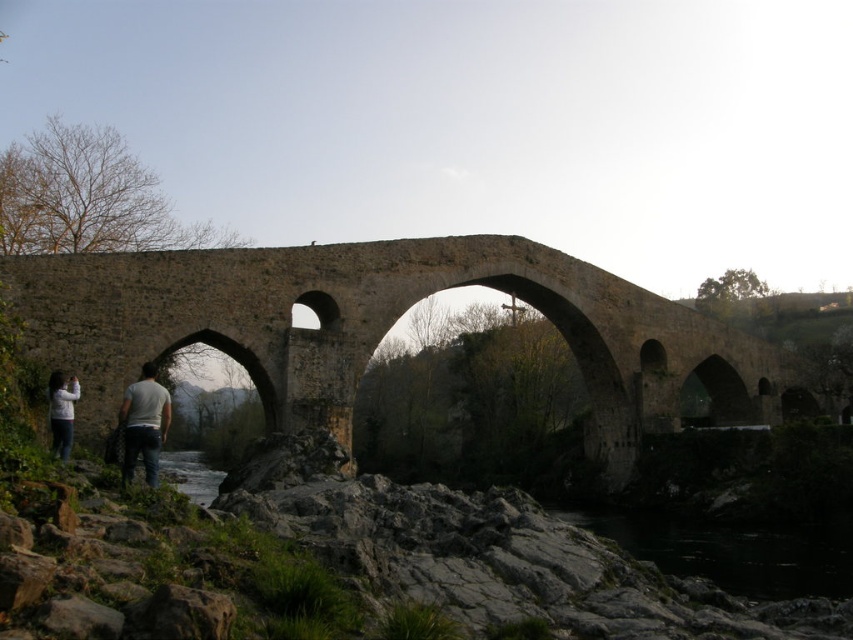
Question: Estimate the real-world distances between objects in this image. Which object is farther from the clear water at lower center?

Choices:
 (A) light gray jeans at center
 (B) stone arch bridge at center

Answer: (B)

Question: Which object is closer to the camera taking this photo?

Choices:
 (A) clear water at lower center
 (B) stone arch bridge at center
 (C) white cotton shirt at lower left

Answer: (C)

Question: Among these objects, which one is nearest to the camera?

Choices:
 (A) white cotton shirt at lower left
 (B) clear water at lower center
 (C) stone arch bridge at center
 (D) light gray jeans at center

Answer: (D)

Question: Can you confirm if stone arch bridge at center is positioned above white cotton shirt at lower left?

Choices:
 (A) no
 (B) yes

Answer: (B)

Question: Does clear water at lower center appear on the left side of white cotton shirt at lower left?

Choices:
 (A) no
 (B) yes

Answer: (B)

Question: Can you confirm if stone arch bridge at center is thinner than clear water at lower center?

Choices:
 (A) no
 (B) yes

Answer: (A)